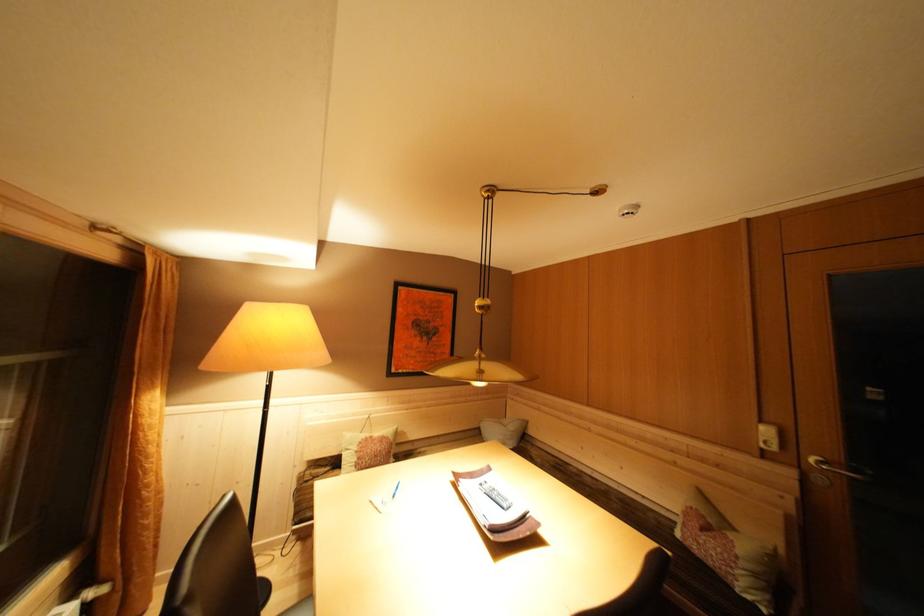
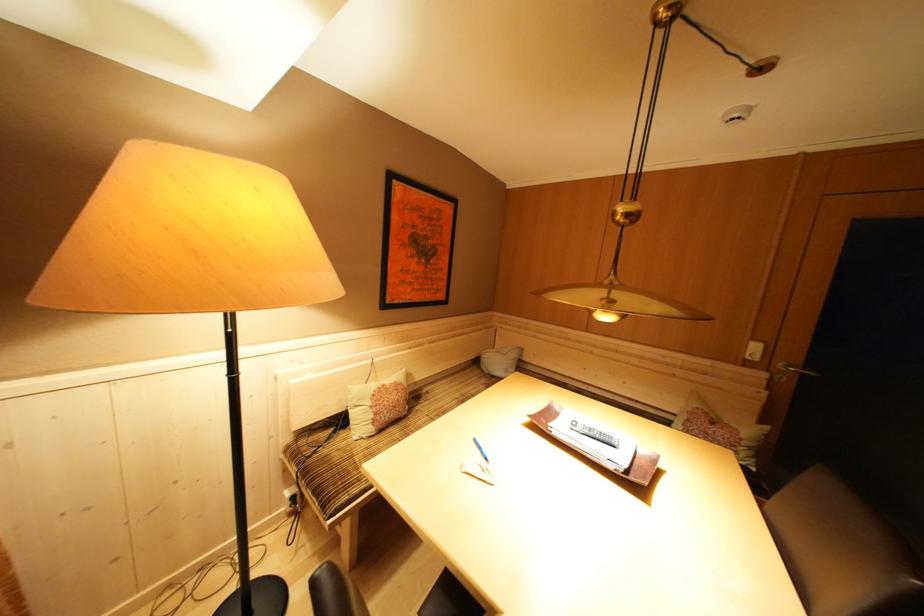
In a continuous first-person perspective shot, in which direction is the camera moving?

The cameraman moved toward left, forward.